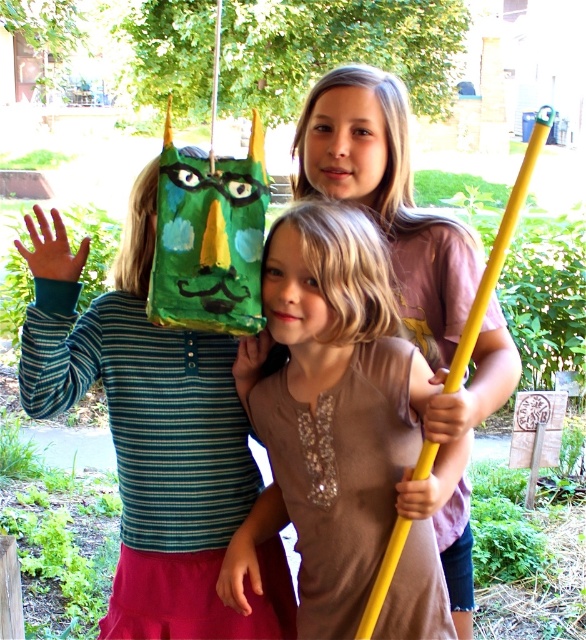
You are organizing a picnic and need to place the matte green paper bag at left and the matte pink shirt at center into a storage box. Which object should you place first to ensure both fit properly?

The matte green paper bag at left is positioned under the matte pink shirt at center, so you should place the matte pink shirt at center first to accommodate the positioning of the matte green paper bag at left underneath it.

You are a photographer setting up for a group photo. You need to arrange the matte brown shirt at center and the matte pink shirt at center so that both can fit comfortably side by side in the frame. Given their sizes, which child should be placed closer to the edge of the frame?

The matte brown shirt at center is thinner than the matte pink shirt at center, so the matte pink shirt at center should be placed closer to the edge of the frame to accommodate its wider width.